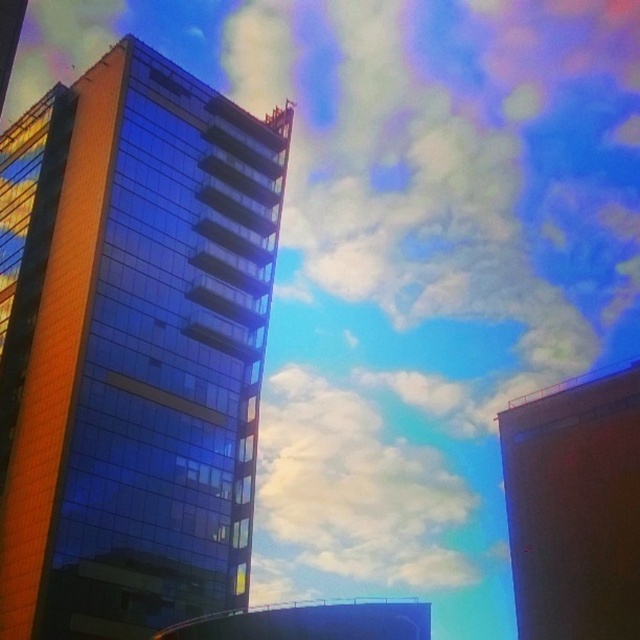
Is point (221, 509) closer to camera compared to point (266, 506)?

Yes, it is.

This screenshot has height=640, width=640. What do you see at coordinates (138, 356) in the screenshot?
I see `shiny glass building at left` at bounding box center [138, 356].

Is point (140, 74) closer to camera compared to point (326, 464)?

Yes, point (140, 74) is in front of point (326, 464).

Identify the location of shiny glass building at left. (138, 356).